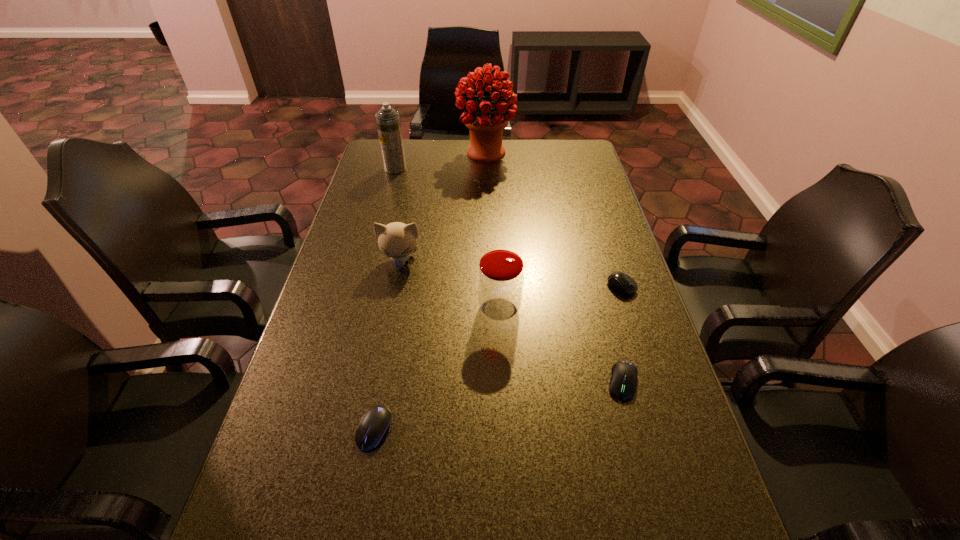
You are a GUI agent. You are given a task and a screenshot of the screen. Output one action in this format:
    pyautogui.click(x=<x>, y=<y>)
    Task: Click on the vacant space that satisfies the following two spatial constraints: 1. on the face of the nearest object; 2. on the left side of the fourth tallest object
    The image size is (960, 540).
    Given the screenshot: What is the action you would take?
    pyautogui.click(x=368, y=430)